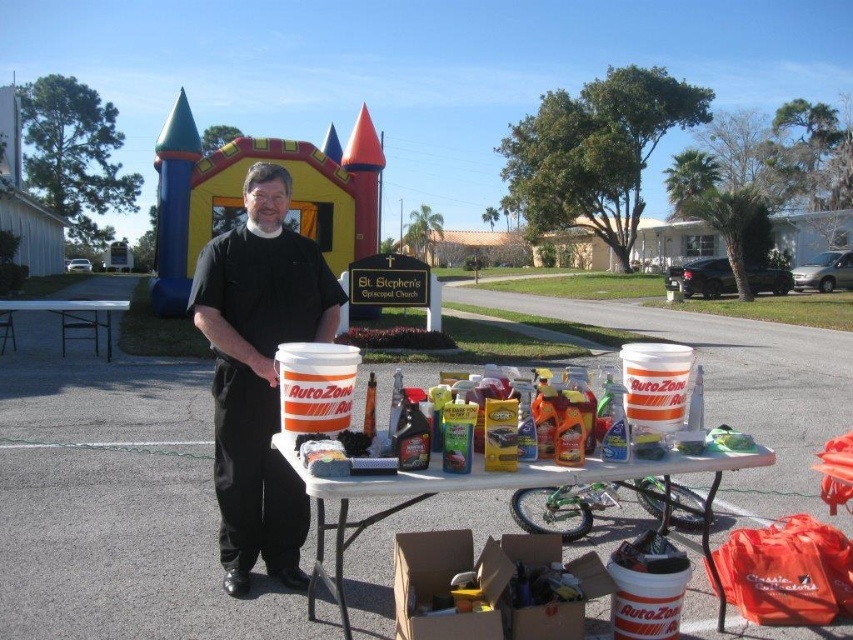
You are a photographer trying to capture both the black matte shirt at center and the white plastic table at left in a single shot. Based on their sizes, which object should you focus on first to ensure both are in frame?

The black matte shirt at center is smaller in size compared to the white plastic table at left. To ensure both are in frame, focus on the white plastic table at left first as it takes up more space, then adjust the camera angle to include the smaller black matte shirt at center.

You are a participant at the event and want to reach the white plastic table at center to grab a brochure. However, you notice the black matte shirt at center in your path. Based on their positions, can you walk directly to the table without going around?

The black matte shirt at center is closer to you than the white plastic table at center, so you would need to walk past the person wearing the black matte shirt at center to reach the table directly.